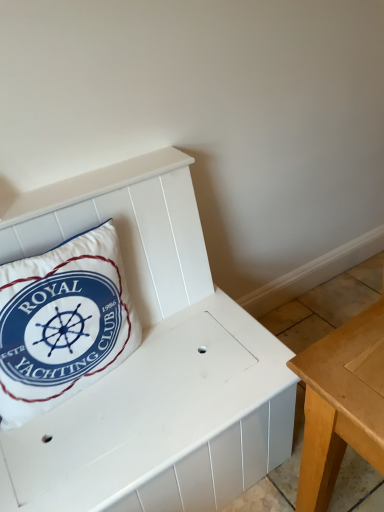
Question: Could you tell me if white fabric pillow at left is facing white matte bench at center?

Choices:
 (A) no
 (B) yes

Answer: (A)

Question: From the image's perspective, would you say white fabric pillow at left is positioned over white matte bench at center?

Choices:
 (A) no
 (B) yes

Answer: (B)

Question: Can you confirm if white fabric pillow at left is bigger than white matte bench at center?

Choices:
 (A) yes
 (B) no

Answer: (B)

Question: From a real-world perspective, does white fabric pillow at left stand above white matte bench at center?

Choices:
 (A) yes
 (B) no

Answer: (A)

Question: From a real-world perspective, is white fabric pillow at left under white matte bench at center?

Choices:
 (A) no
 (B) yes

Answer: (A)

Question: Would you consider white fabric pillow at left to be distant from white matte bench at center?

Choices:
 (A) no
 (B) yes

Answer: (A)

Question: Is white matte bench at center positioned beyond the bounds of white fabric pillow at left?

Choices:
 (A) no
 (B) yes

Answer: (B)

Question: From the image's perspective, would you say white matte bench at center is positioned over white fabric pillow at left?

Choices:
 (A) no
 (B) yes

Answer: (A)

Question: Is white matte bench at center wider than white fabric pillow at left?

Choices:
 (A) yes
 (B) no

Answer: (A)

Question: Considering the relative positions of white matte bench at center and white fabric pillow at left in the image provided, is white matte bench at center to the left of white fabric pillow at left from the viewer's perspective?

Choices:
 (A) no
 (B) yes

Answer: (A)

Question: From a real-world perspective, is white matte bench at center located beneath white fabric pillow at left?

Choices:
 (A) yes
 (B) no

Answer: (A)

Question: Does white matte bench at center have a lesser height compared to white fabric pillow at left?

Choices:
 (A) no
 (B) yes

Answer: (B)

Question: Is white matte bench at center wider or thinner than white fabric pillow at left?

Choices:
 (A) thin
 (B) wide

Answer: (B)